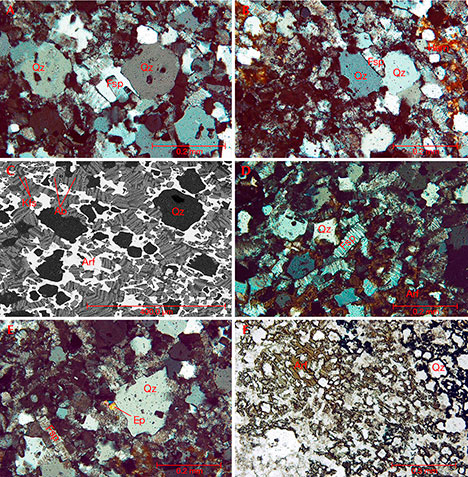
Identify the location of label art. This screenshot has height=477, width=468. (90, 259).